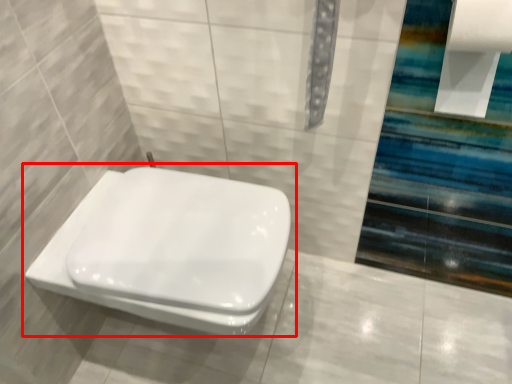
Question: From the image's perspective, considering the relative positions of toilet (annotated by the red box) and toilet paper in the image provided, where is toilet (annotated by the red box) located with respect to the staircase?

Choices:
 (A) below
 (B) above

Answer: (A)